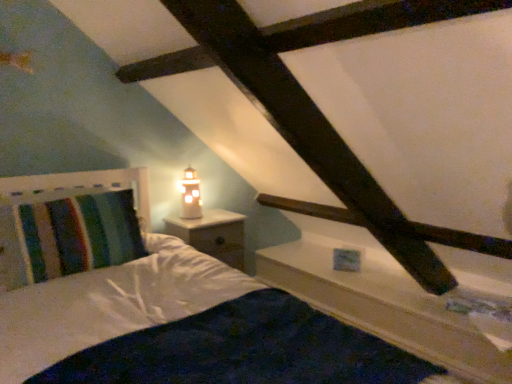
Question: Relative to striped fabric pillow at left, is white wood ledge at upper right in front or behind?

Choices:
 (A) behind
 (B) front

Answer: (A)

Question: From a real-world perspective, is white wood ledge at upper right above or below striped fabric pillow at left?

Choices:
 (A) below
 (B) above

Answer: (A)

Question: Based on their relative distances, which object is farther from the white wood nightstand at center?

Choices:
 (A) white wood ledge at upper right
 (B) matte glass table lamp at upper center
 (C) striped fabric pillow at left

Answer: (A)

Question: Estimate the real-world distances between objects in this image. Which object is closer to the striped fabric pillow at left?

Choices:
 (A) white wood ledge at upper right
 (B) white wood nightstand at center
 (C) matte glass table lamp at upper center

Answer: (B)